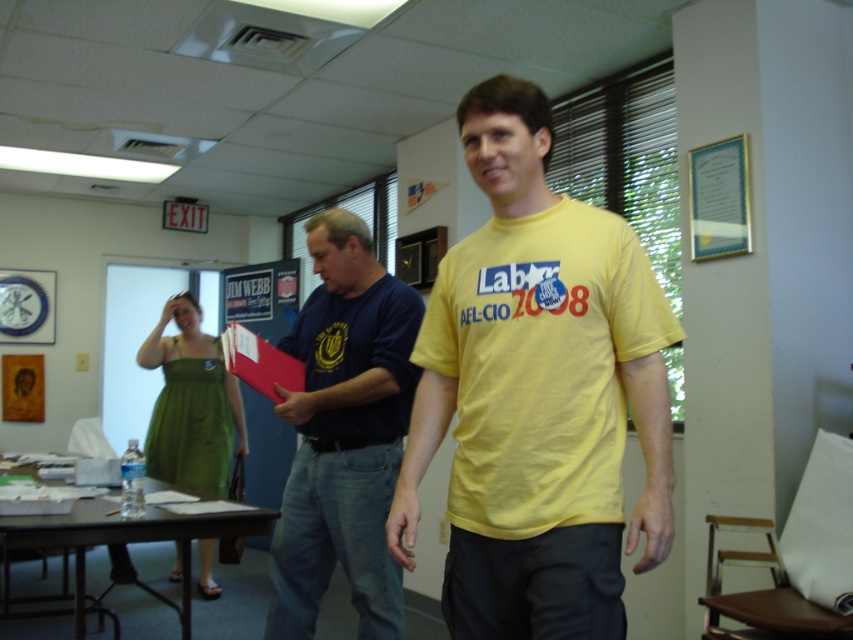
Question: Which point is closer to the camera taking this photo?

Choices:
 (A) (317, 353)
 (B) (587, 289)

Answer: (B)

Question: Which of the following is the farthest from the observer?

Choices:
 (A) (621, 580)
 (B) (270, 636)

Answer: (B)

Question: Can you confirm if yellow cotton t-shirt at center is positioned below dark blue t-shirt at center?

Choices:
 (A) no
 (B) yes

Answer: (A)

Question: Does yellow cotton t-shirt at center appear on the left side of dark blue t-shirt at center?

Choices:
 (A) yes
 (B) no

Answer: (B)

Question: Does yellow cotton t-shirt at center have a smaller size compared to dark blue t-shirt at center?

Choices:
 (A) yes
 (B) no

Answer: (B)